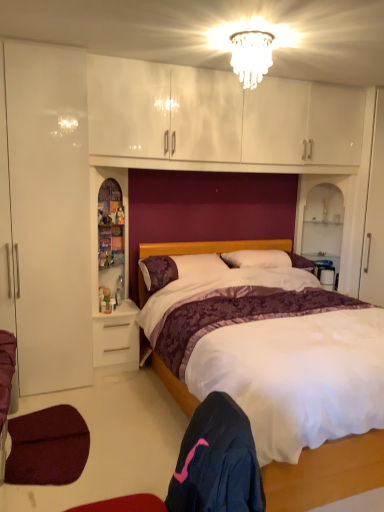
Question: Is translucent plastic bottle at left beside clear glass chandelier at upper center?

Choices:
 (A) yes
 (B) no

Answer: (B)

Question: From a real-world perspective, is translucent plastic bottle at left on top of clear glass chandelier at upper center?

Choices:
 (A) yes
 (B) no

Answer: (B)

Question: Can you confirm if translucent plastic bottle at left is wider than clear glass chandelier at upper center?

Choices:
 (A) yes
 (B) no

Answer: (B)

Question: Is the position of translucent plastic bottle at left less distant than that of clear glass chandelier at upper center?

Choices:
 (A) no
 (B) yes

Answer: (A)

Question: Is translucent plastic bottle at left shorter than clear glass chandelier at upper center?

Choices:
 (A) no
 (B) yes

Answer: (B)

Question: Considering the relative positions of translucent plastic bottle at left and clear glass chandelier at upper center in the image provided, is translucent plastic bottle at left to the left of clear glass chandelier at upper center from the viewer's perspective?

Choices:
 (A) yes
 (B) no

Answer: (A)

Question: Is dark blue fabric at lower center aimed at translucent plastic bottle at left?

Choices:
 (A) yes
 (B) no

Answer: (B)

Question: From the image's perspective, is dark blue fabric at lower center above translucent plastic bottle at left?

Choices:
 (A) no
 (B) yes

Answer: (A)

Question: Is translucent plastic bottle at left completely or partially inside dark blue fabric at lower center?

Choices:
 (A) yes
 (B) no

Answer: (B)

Question: Can you confirm if dark blue fabric at lower center is smaller than translucent plastic bottle at left?

Choices:
 (A) yes
 (B) no

Answer: (B)

Question: From a real-world perspective, is dark blue fabric at lower center physically above translucent plastic bottle at left?

Choices:
 (A) yes
 (B) no

Answer: (B)

Question: Would you consider dark blue fabric at lower center to be distant from translucent plastic bottle at left?

Choices:
 (A) no
 (B) yes

Answer: (B)

Question: Is dark blue fabric at lower center at the back of translucent plastic bottle at left?

Choices:
 (A) yes
 (B) no

Answer: (B)